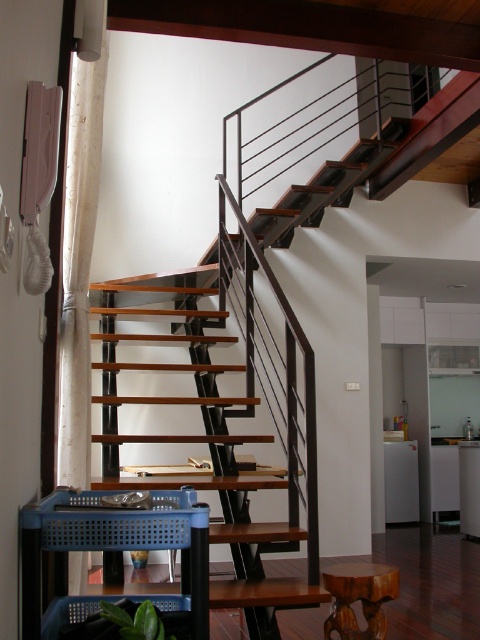
Question: Observing the image, what is the correct spatial positioning of blue plastic basket at lower left in reference to wooden stool at lower right?

Choices:
 (A) above
 (B) below

Answer: (A)

Question: Does blue plastic basket at lower left come in front of wooden stool at lower right?

Choices:
 (A) yes
 (B) no

Answer: (A)

Question: Which point appears farthest from the camera in this image?

Choices:
 (A) (54, 536)
 (B) (384, 579)

Answer: (B)

Question: Can you confirm if blue plastic basket at lower left is thinner than wooden stool at lower right?

Choices:
 (A) no
 (B) yes

Answer: (A)

Question: Which object appears closest to the camera in this image?

Choices:
 (A) blue plastic basket at lower left
 (B) wooden stool at lower right

Answer: (A)